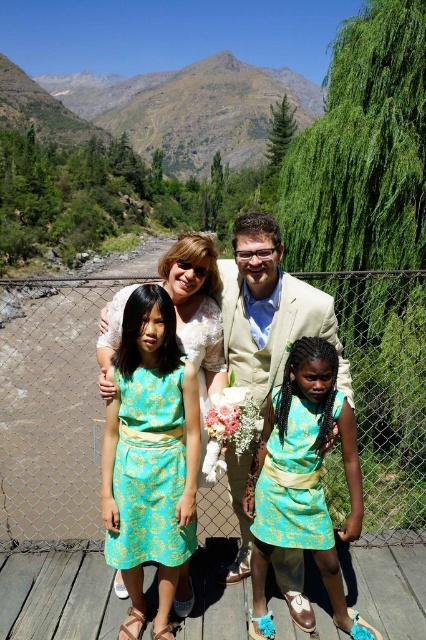
Consider the image. You are a photographer trying to frame a group photo. You have two focal points in the image, the turquoise brocade dress at center and the light beige suit at center. Which focal point should you focus on if you want to capture the narrower object?

The turquoise brocade dress at center has a lesser width compared to the light beige suit at center, so you should focus on the turquoise brocade dress at center to capture the narrower object.

You are a photographer adjusting your camera settings to focus on the teal brocade dress at center and the light beige suit at center. Which one should you focus on first to ensure proper depth of field?

The teal brocade dress at center is closer to the viewer than the light beige suit at center, so you should focus on the teal brocade dress at center first to ensure proper depth of field.